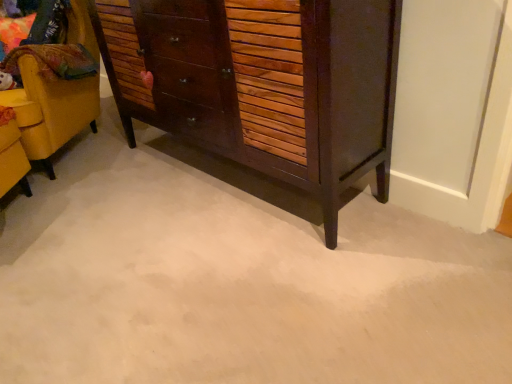
Question: Choose the correct answer: Is wooden cabinet at right inside dark brown wood chest of drawers at center or outside it?

Choices:
 (A) outside
 (B) inside

Answer: (A)

Question: Relative to dark brown wood chest of drawers at center, is wooden cabinet at right in front or behind?

Choices:
 (A) front
 (B) behind

Answer: (B)

Question: From a real-world perspective, is wooden cabinet at right physically located above or below dark brown wood chest of drawers at center?

Choices:
 (A) below
 (B) above

Answer: (A)

Question: Relative to wooden cabinet at right, is dark brown wood chest of drawers at center in front or behind?

Choices:
 (A) front
 (B) behind

Answer: (A)

Question: In terms of width, does dark brown wood chest of drawers at center look wider or thinner when compared to wooden cabinet at right?

Choices:
 (A) thin
 (B) wide

Answer: (A)

Question: Is point (238, 36) positioned closer to the camera than point (62, 92)?

Choices:
 (A) farther
 (B) closer

Answer: (B)

Question: From a real-world perspective, is dark brown wood chest of drawers at center physically located above or below wooden cabinet at right?

Choices:
 (A) below
 (B) above

Answer: (B)